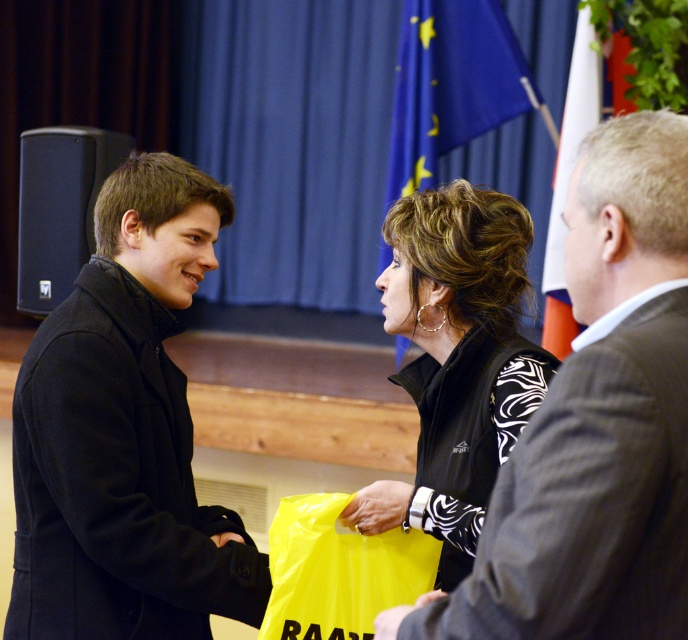
Which is more to the left, black zebra-patterned jacket at center or yellow plastic bag at center?

From the viewer's perspective, yellow plastic bag at center appears more on the left side.

Is point (464, 467) closer to camera compared to point (411, 593)?

Yes, it is in front of point (411, 593).

Locate an element on the screen. black zebra-patterned jacket at center is located at coordinates (455, 362).

Is matte black suit at center thinner than blue fabric flag at upper center?

Yes.

Is matte black suit at center smaller than blue fabric flag at upper center?

Yes.

What are the coordinates of `matte black suit at center` in the screenshot? It's located at (596, 424).

Image resolution: width=688 pixels, height=640 pixels. What do you see at coordinates (125, 435) in the screenshot?
I see `black wool coat at center` at bounding box center [125, 435].

Between black wool coat at center and black zebra-patterned jacket at center, which one has less height?

black zebra-patterned jacket at center is shorter.

Find the location of a particular element. black wool coat at center is located at coordinates (125, 435).

This screenshot has height=640, width=688. Find the location of `black wool coat at center`. black wool coat at center is located at coordinates (x=125, y=435).